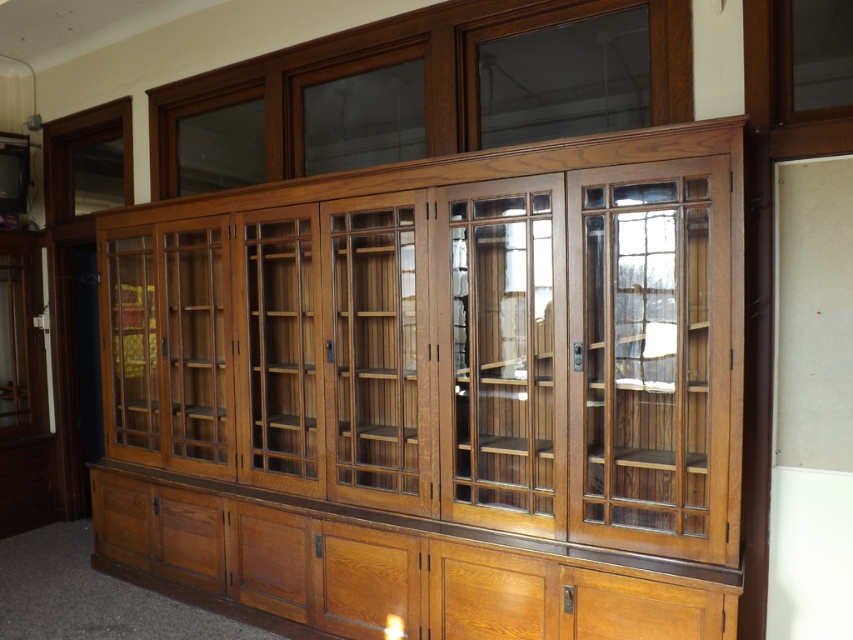
Question: Is clear glass cabinet at center positioned before clear wood glass door at center?

Choices:
 (A) yes
 (B) no

Answer: (B)

Question: Which point is farther from the camera taking this photo?

Choices:
 (A) [547, 536]
 (B) [590, 307]

Answer: (B)

Question: Can you confirm if clear glass cabinet at center is positioned to the left of clear wood glass door at center?

Choices:
 (A) yes
 (B) no

Answer: (A)

Question: Which object appears farthest from the camera in this image?

Choices:
 (A) clear wood glass door at center
 (B) clear glass cabinet at center

Answer: (B)

Question: Can you confirm if clear glass cabinet at center is thinner than clear wood glass door at center?

Choices:
 (A) no
 (B) yes

Answer: (B)